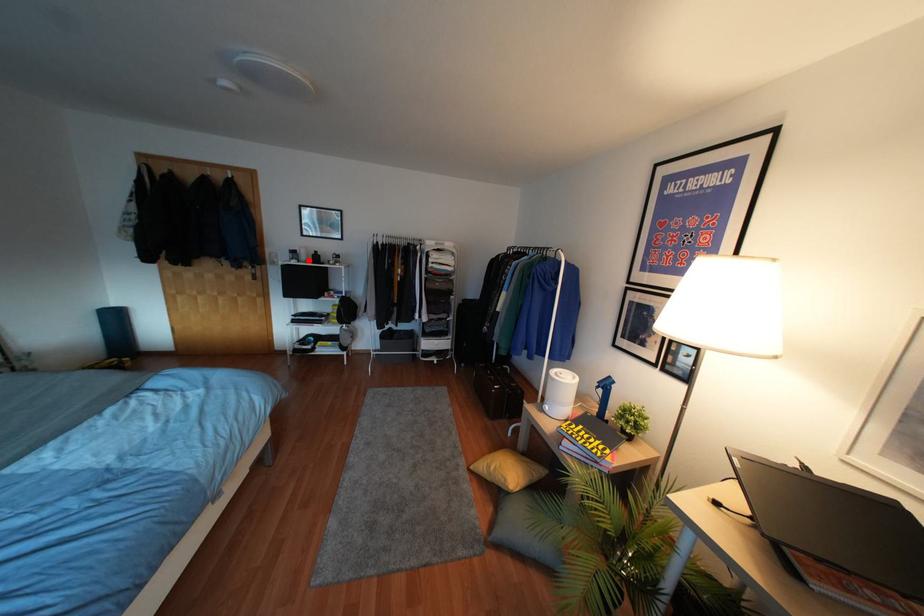
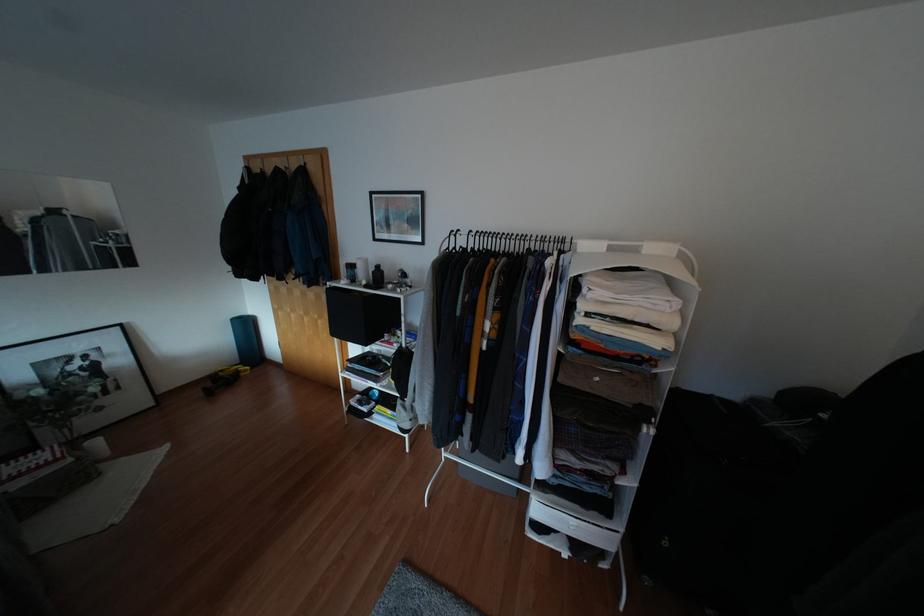
In the second image, find the point that corresponds to the highlighted location in the first image.

(362, 282)